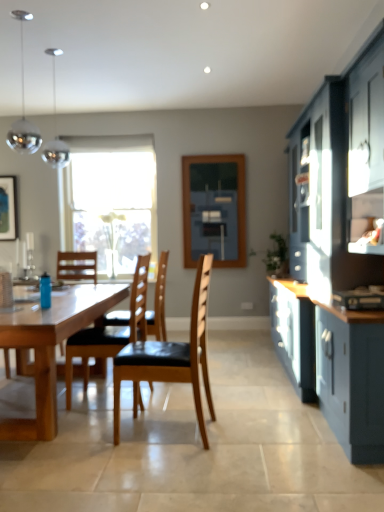
You are a GUI agent. You are given a task and a screenshot of the screen. Output one action in this format:
    pyautogui.click(x=<x>, y=<y>)
    Task: Click on the free space to the back side of brown leather chair at center, which is the first chair in front-to-back order
    The image size is (384, 512).
    Given the screenshot: What is the action you would take?
    pyautogui.click(x=182, y=405)